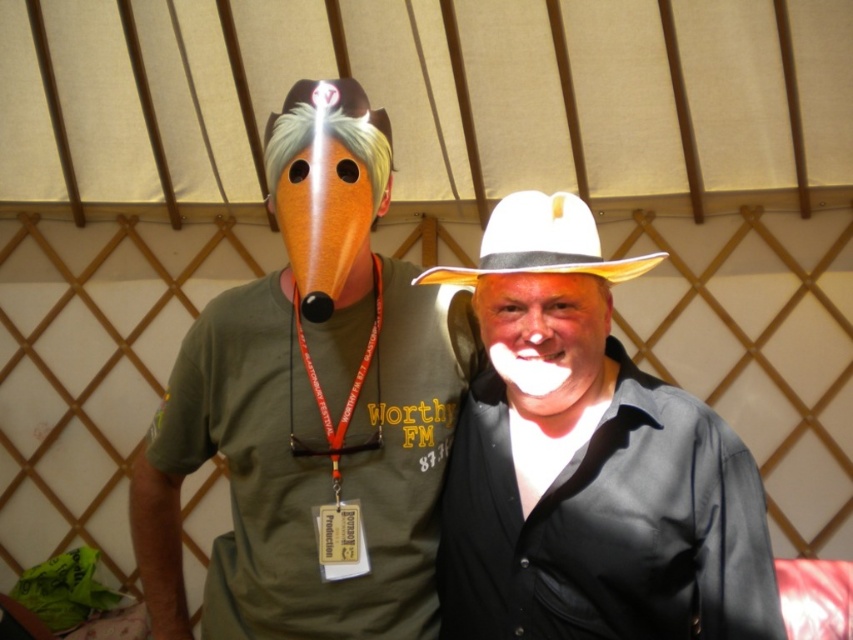
Who is shorter, matte orange mask at center or white felt cowboy hat at center?

white felt cowboy hat at center

Is point (289, 618) less distant than point (605, 276)?

No.

Does point (326, 564) come farther from viewer compared to point (450, 273)?

Yes, point (326, 564) is farther from viewer.

Image resolution: width=853 pixels, height=640 pixels. What are the coordinates of `matte orange mask at center` in the screenshot? It's located at (312, 406).

Is matte orange mask at center below white matte cowboy hat at center?

Yes.

Is point (258, 547) farther from camera compared to point (653, 419)?

Yes, point (258, 547) is behind point (653, 419).

Is point (409, 449) positioned behind point (463, 474)?

That is True.

Find the location of a particular element. The height and width of the screenshot is (640, 853). matte orange mask at center is located at coordinates (312, 406).

Who is more distant from viewer, (566, 609) or (496, 253)?

The point (566, 609) is more distant.

Which is in front, point (512, 426) or point (514, 211)?

Point (514, 211) is more forward.

Identify the location of white matte cowboy hat at center. The width and height of the screenshot is (853, 640). (587, 461).